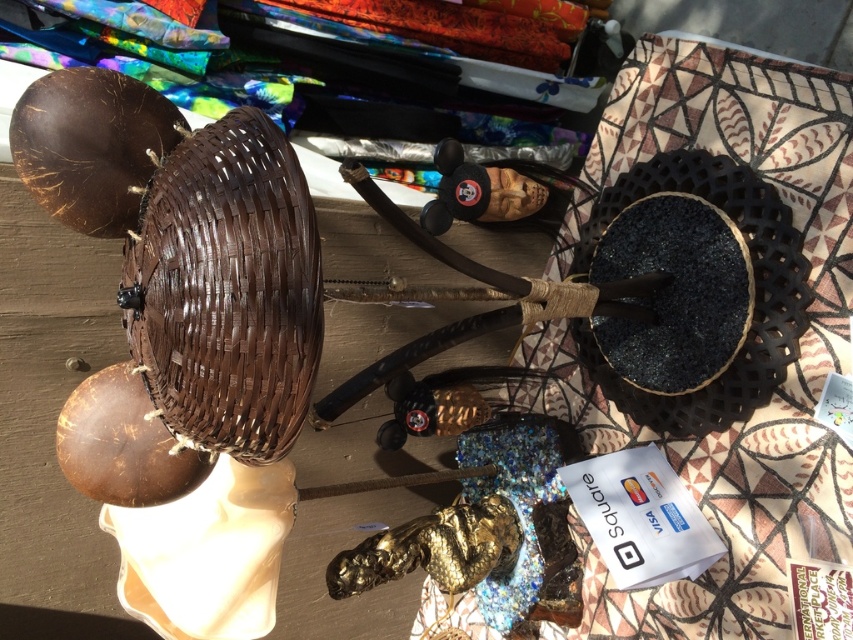
Who is positioned more to the left, brown woven basket at upper left or black woven basket at upper right?

From the viewer's perspective, brown woven basket at upper left appears more on the left side.

Can you confirm if brown woven basket at upper left is bigger than black woven basket at upper right?

Incorrect, brown woven basket at upper left is not larger than black woven basket at upper right.

Which is behind, point (248, 390) or point (775, 216)?

The point (775, 216) is behind.

In order to click on brown woven basket at upper left in this screenshot , I will do `click(227, 289)`.